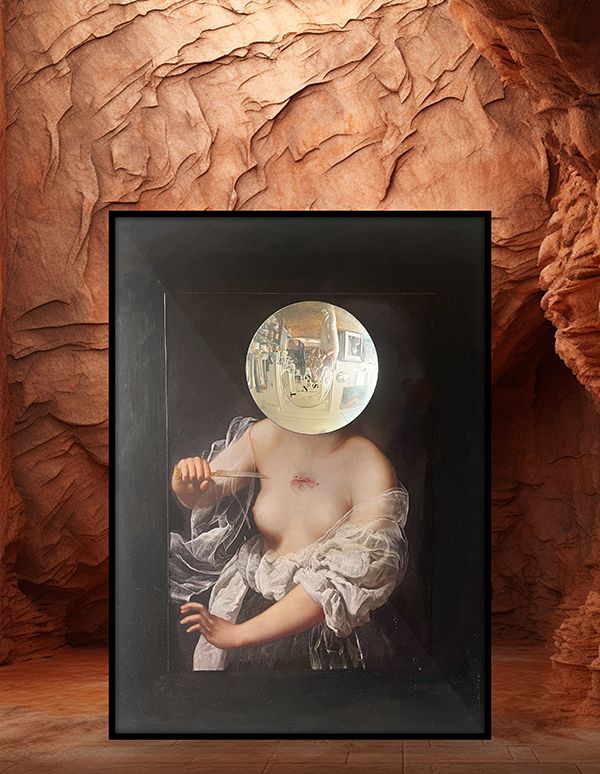
What are the coordinates of `picture frame` in the screenshot? It's located at (111, 460), (291, 738), (490, 475), (309, 211).